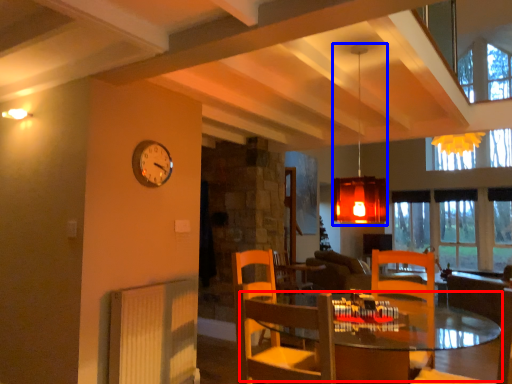
Question: Among these objects, which one is farthest to the camera, table (highlighted by a red box) or lamp (highlighted by a blue box)?

Choices:
 (A) table
 (B) lamp

Answer: (B)